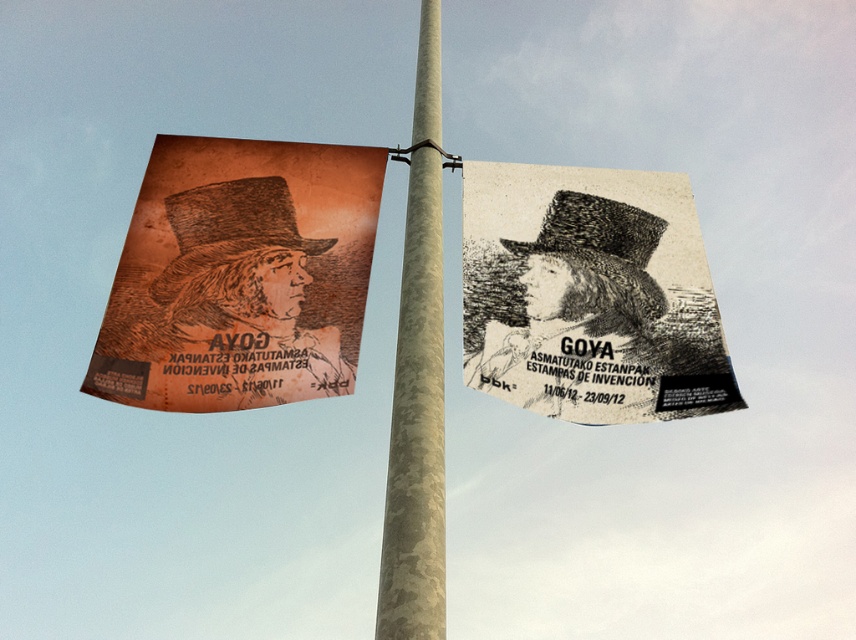
You are an event organizer who needs to hang a new banner that is 3 meters wide between the orange paper poster at left and the black textured paper at upper right. Can you fit it without overlapping either? Please explain using the distance between them.

The orange paper poster at left and the black textured paper at upper right are 6.52 meters apart. Since the new banner is 3 meters wide, there is enough space between them to fit it without overlapping either, as 3 meters is less than 6.52 meters.

You are standing at the base of the pole where the banners hang. There are two points marked on the banners. The first point is at coordinates point (x=663, y=384) and the second is at point (x=397, y=360). Which point is closer to you?

Point (x=397, y=360) is closer to you because it is in front of point (x=663, y=384).